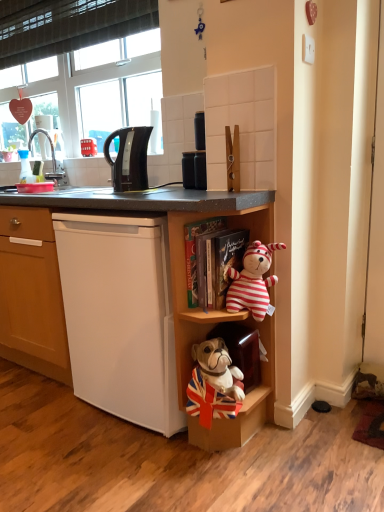
The width and height of the screenshot is (384, 512). Find the location of `free space that is to the left of wooden shelf at lower right, marked as the 2th shelf in a top-to-bottom arrangement`. free space that is to the left of wooden shelf at lower right, marked as the 2th shelf in a top-to-bottom arrangement is located at coordinates (141, 453).